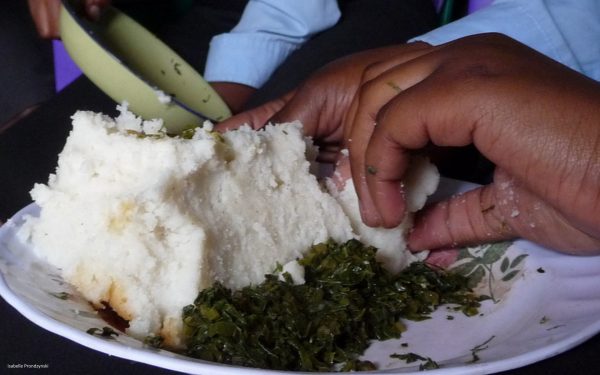
The height and width of the screenshot is (375, 600). I want to click on white plate, so click(x=543, y=328).